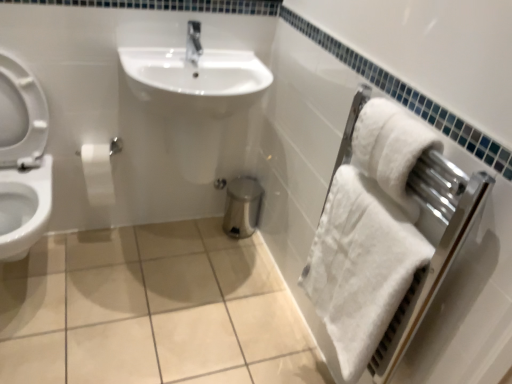
Question: From a real-world perspective, is white fluffy bath towel at right, positioned as the second bath towel in top-to-bottom order, positioned above or below white soft towel at right?

Choices:
 (A) below
 (B) above

Answer: (A)

Question: Is white fluffy bath towel at right, positioned as the second bath towel in top-to-bottom order, inside the boundaries of white soft towel at right, or outside?

Choices:
 (A) outside
 (B) inside

Answer: (B)

Question: Which of these objects is positioned closest to the white soft towel at right?

Choices:
 (A) white matte toilet paper at left
 (B) white glossy toilet at left
 (C) white soft towel at right, which appears as the second bath towel when ordered from the bottom
 (D) beige ceramic tile at center
 (E) white fluffy bath towel at right, the first bath towel in the bottom-to-top sequence

Answer: (C)

Question: Which of these objects is positioned farthest from the white glossy sink at center?

Choices:
 (A) white fluffy bath towel at right, the first bath towel in the bottom-to-top sequence
 (B) white soft towel at right, which appears as the second bath towel when ordered from the bottom
 (C) white soft towel at right
 (D) white glossy toilet at left
 (E) beige ceramic tile at center

Answer: (B)